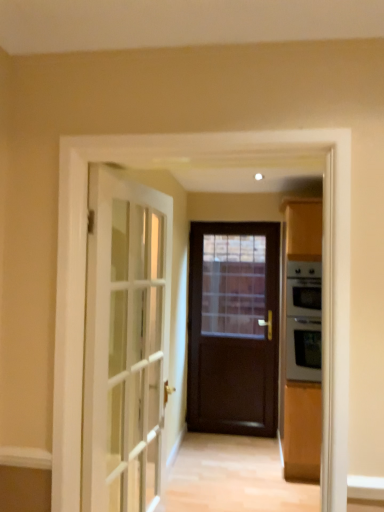
Question: Considering the relative sizes of silver metallic oven at right and dark wood door at center, which is counted as the 2th door, starting from the left, in the image provided, is silver metallic oven at right shorter than dark wood door at center, which is counted as the 2th door, starting from the left,?

Choices:
 (A) yes
 (B) no

Answer: (A)

Question: Can you confirm if silver metallic oven at right is bigger than dark wood door at center, positioned as the second door in front-to-back order?

Choices:
 (A) no
 (B) yes

Answer: (B)

Question: Does silver metallic oven at right come behind dark wood door at center, which ranks as the first door in right-to-left order?

Choices:
 (A) yes
 (B) no

Answer: (B)

Question: Is silver metallic oven at right placed right next to dark wood door at center, positioned as the second door in front-to-back order?

Choices:
 (A) no
 (B) yes

Answer: (A)

Question: From a real-world perspective, is silver metallic oven at right located beneath dark wood door at center, the first door in the back-to-front sequence?

Choices:
 (A) yes
 (B) no

Answer: (B)

Question: Considering the relative positions of silver metallic oven at right and dark wood door at center, positioned as the second door in front-to-back order, in the image provided, is silver metallic oven at right in front of dark wood door at center, positioned as the second door in front-to-back order,?

Choices:
 (A) yes
 (B) no

Answer: (A)

Question: Is dark wood door at center, which is counted as the 2th door, starting from the left, positioned before silver metallic oven at right?

Choices:
 (A) yes
 (B) no

Answer: (B)

Question: From the image's perspective, is dark wood door at center, the first door in the back-to-front sequence, located above silver metallic oven at right?

Choices:
 (A) yes
 (B) no

Answer: (B)

Question: Is dark wood door at center, which is counted as the 2th door, starting from the left, positioned behind silver metallic oven at right?

Choices:
 (A) yes
 (B) no

Answer: (A)

Question: Can you confirm if dark wood door at center, the first door in the back-to-front sequence, is smaller than silver metallic oven at right?

Choices:
 (A) no
 (B) yes

Answer: (B)

Question: Does dark wood door at center, which is counted as the 2th door, starting from the left, have a greater height compared to silver metallic oven at right?

Choices:
 (A) no
 (B) yes

Answer: (B)

Question: Does dark wood door at center, which is counted as the 2th door, starting from the left, have a lesser height compared to silver metallic oven at right?

Choices:
 (A) yes
 (B) no

Answer: (B)

Question: Is silver metallic oven at right smaller than white glass door at left, which is the second door in back-to-front order?

Choices:
 (A) yes
 (B) no

Answer: (B)